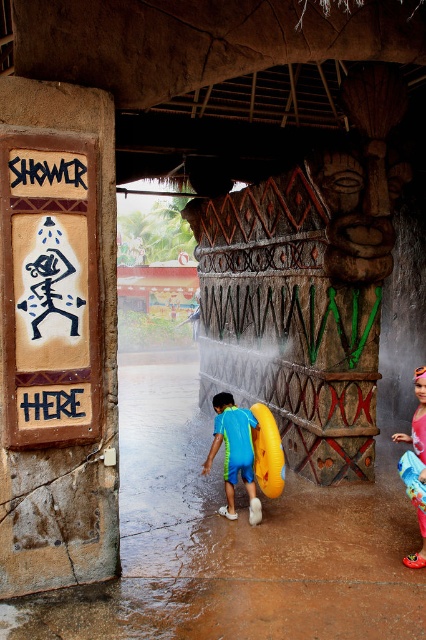
Question: Which object is the farthest from the blue rubber ring at center?

Choices:
 (A) black wood sign at upper left
 (B) fluorescent pink rubber boots at lower right

Answer: (A)

Question: Which of the following is the closest to the observer?

Choices:
 (A) (420, 416)
 (B) (63, 173)

Answer: (B)

Question: Can you confirm if blue rubber ring at center is positioned above black wood sign at upper left?

Choices:
 (A) yes
 (B) no

Answer: (B)

Question: Considering the real-world distances, which object is farthest from the matte brown sign at left?

Choices:
 (A) fluorescent pink rubber boots at lower right
 (B) black wood sign at upper left

Answer: (A)

Question: Does matte brown sign at left have a lesser width compared to black wood sign at upper left?

Choices:
 (A) no
 (B) yes

Answer: (A)

Question: Does fluorescent pink rubber boots at lower right come in front of black wood sign at upper left?

Choices:
 (A) no
 (B) yes

Answer: (A)